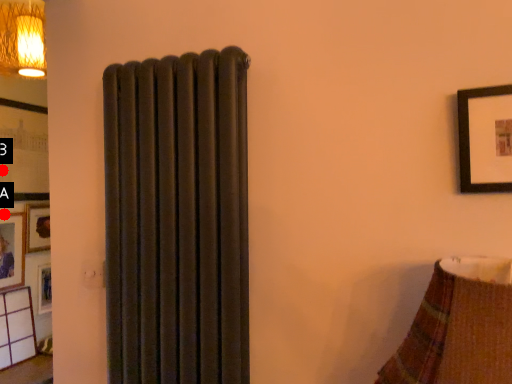
Question: Two points are circled on the image, labeled by A and B beside each circle. Among these points, which one is nearest to the camera?

Choices:
 (A) A is closer
 (B) B is closer

Answer: (B)